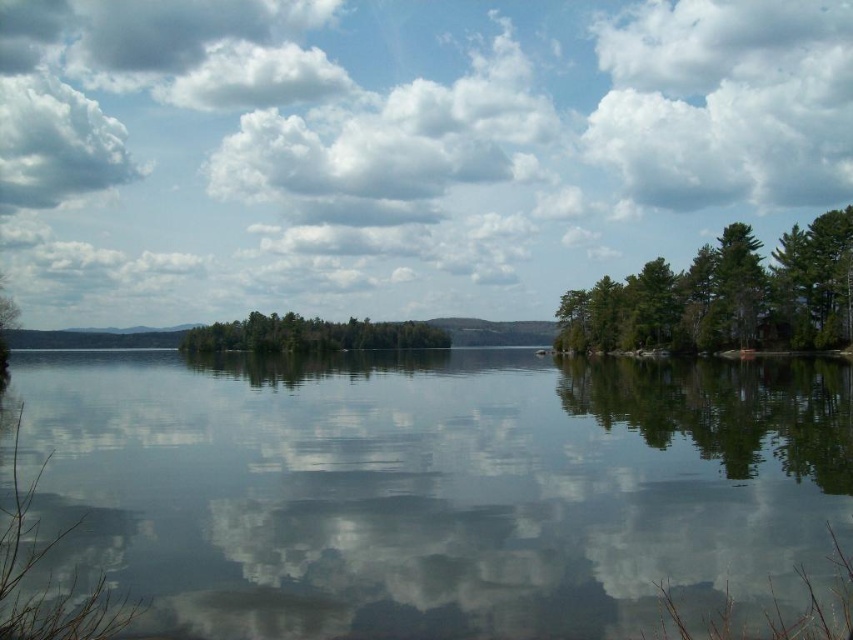
Question: Which object is the farthest from the green matte trees at center?

Choices:
 (A) green matte tree at right
 (B) transparent water at center

Answer: (B)

Question: Is green matte tree at right positioned at the back of cloudy sky at upper left?

Choices:
 (A) yes
 (B) no

Answer: (B)

Question: Which object is positioned closest to the cloudy sky at upper center?

Choices:
 (A) green matte trees at center
 (B) transparent water at center
 (C) cloudy sky at upper left
 (D) cloudy white cloud at upper left

Answer: (D)

Question: Is cloudy white cloud at upper left smaller than green matte trees at center?

Choices:
 (A) yes
 (B) no

Answer: (B)

Question: Is green matte tree at right further to the viewer compared to cloudy white cloud at upper left?

Choices:
 (A) yes
 (B) no

Answer: (B)

Question: Which point appears farthest from the camera in this image?

Choices:
 (A) (178, 65)
 (B) (82, 99)
 (C) (180, 346)
 (D) (257, 385)

Answer: (B)